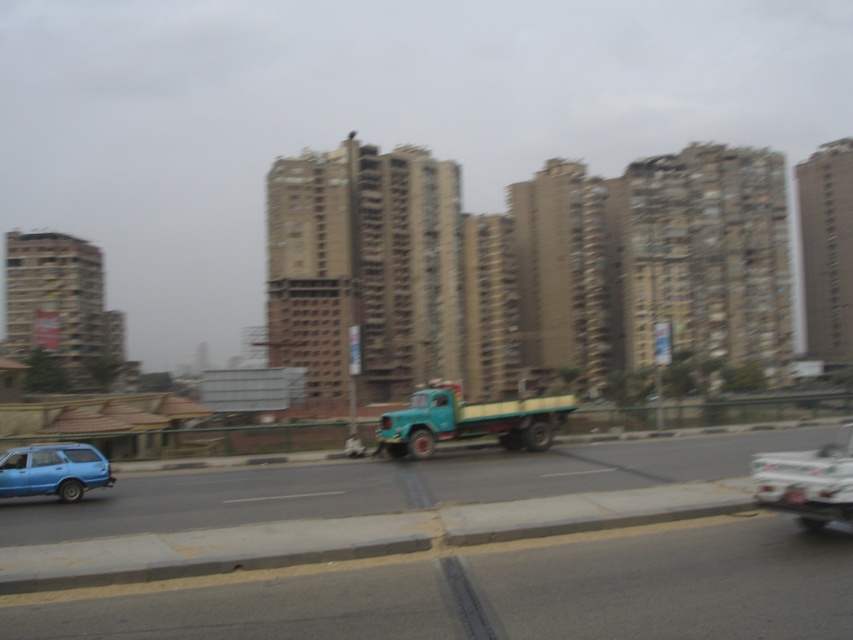
Question: Which point is closer to the camera?

Choices:
 (A) metallic blue truck at center
 (B) matte blue car at lower left
 (C) teal matte truck at center

Answer: (A)

Question: Can you confirm if matte green truck at center is thinner than metallic blue truck at center?

Choices:
 (A) no
 (B) yes

Answer: (A)

Question: Can you confirm if matte green truck at center is wider than metallic blue truck at center?

Choices:
 (A) yes
 (B) no

Answer: (A)

Question: Which is farther from the matte blue car at lower left?

Choices:
 (A) metallic blue truck at center
 (B) matte green truck at center

Answer: (A)

Question: Which object is farther from the camera taking this photo?

Choices:
 (A) matte green truck at center
 (B) teal matte truck at center
 (C) matte blue car at lower left
 (D) metallic blue truck at center

Answer: (B)

Question: Does teal matte truck at center appear under matte blue car at lower left?

Choices:
 (A) yes
 (B) no

Answer: (B)